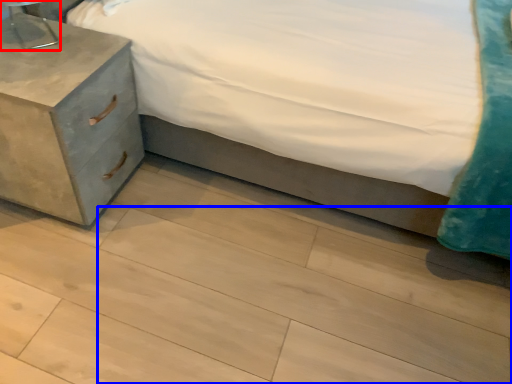
Question: Which object is further to the camera taking this photo, table lamp (highlighted by a red box) or tile (highlighted by a blue box)?

Choices:
 (A) table lamp
 (B) tile

Answer: (A)